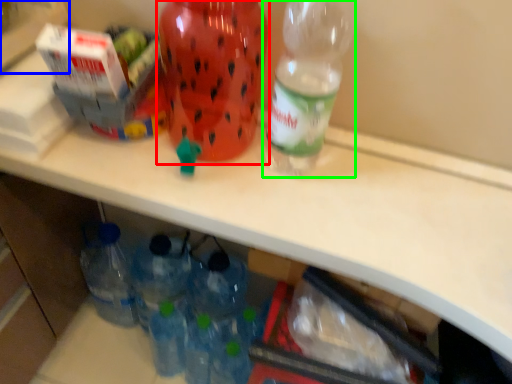
Question: Which is nearer to the bottle (highlighted by a red box)? box (highlighted by a blue box) or bottle (highlighted by a green box).

Choices:
 (A) box
 (B) bottle

Answer: (B)